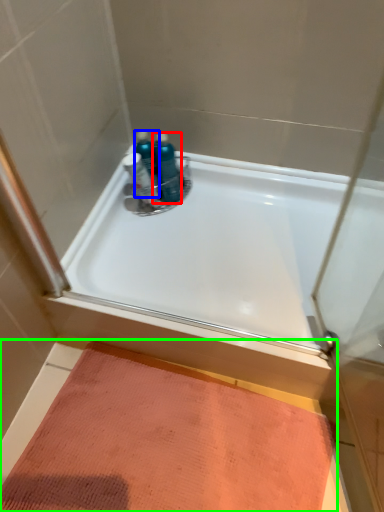
Question: Estimate the real-world distances between objects in this image. Which object is closer to toiletry (highlighted by a red box), toiletry (highlighted by a blue box) or doormat (highlighted by a green box)?

Choices:
 (A) toiletry
 (B) doormat

Answer: (A)